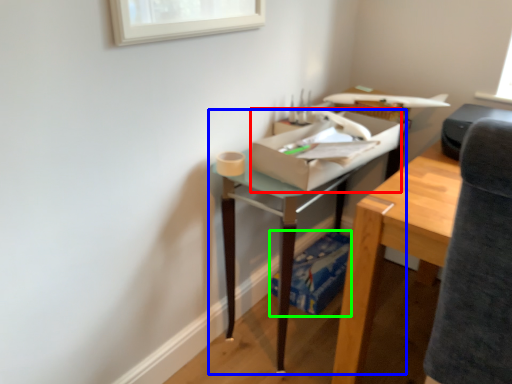
Question: Which object is positioned farthest from cardboard box (highlighted by a red box)? Select from table (highlighted by a blue box) and cardboard box (highlighted by a green box).

Choices:
 (A) table
 (B) cardboard box

Answer: (B)